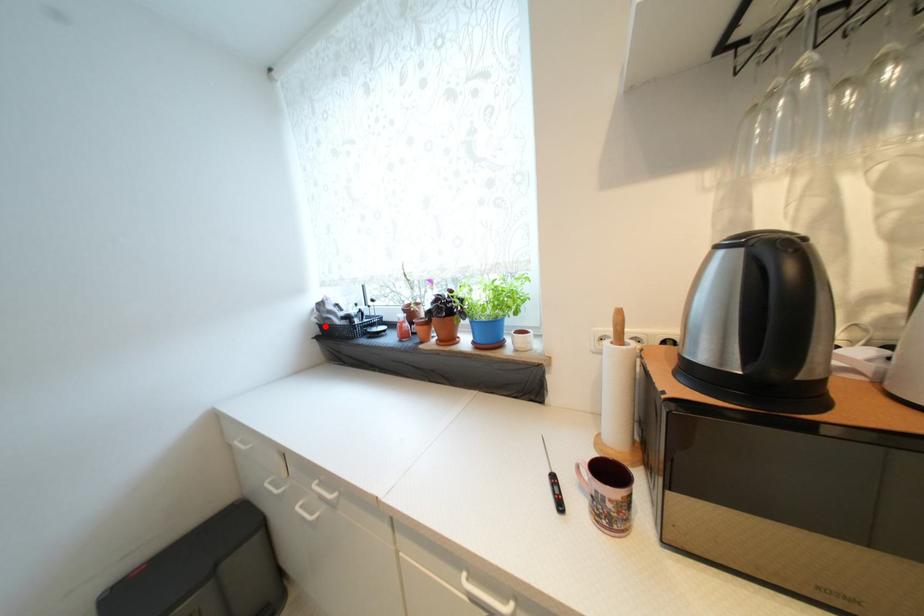
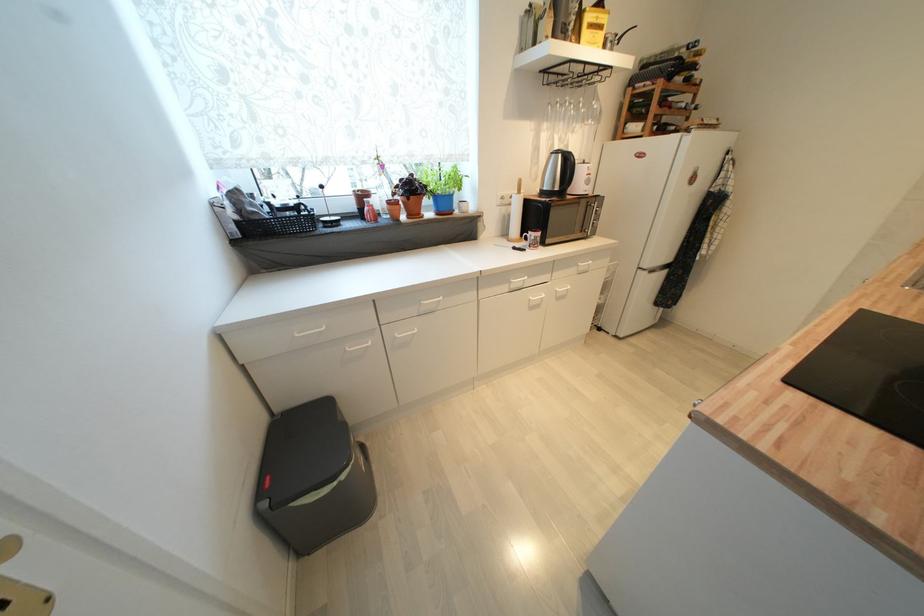
In the second image, find the point that corresponds to the highlighted location in the first image.

(242, 225)